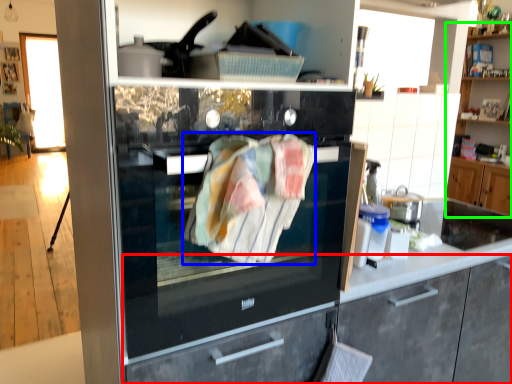
Question: Which object is positioned closest to cabinetry (highlighted by a red box)? Select from blanket (highlighted by a blue box) and cabinetry (highlighted by a green box).

Choices:
 (A) blanket
 (B) cabinetry

Answer: (A)